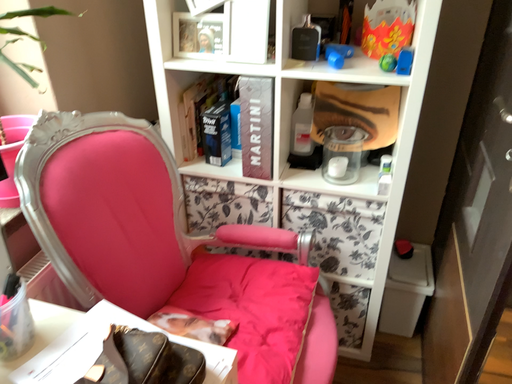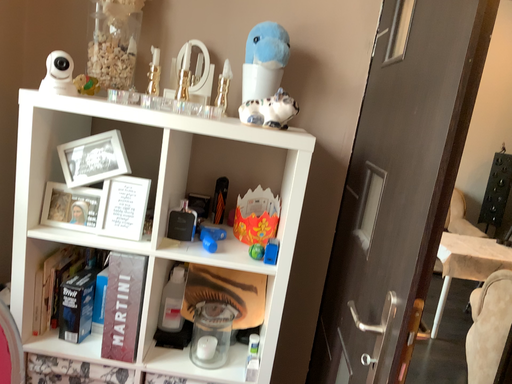
Question: How did the camera likely rotate when shooting the video?

Choices:
 (A) rotated left
 (B) rotated right

Answer: (B)